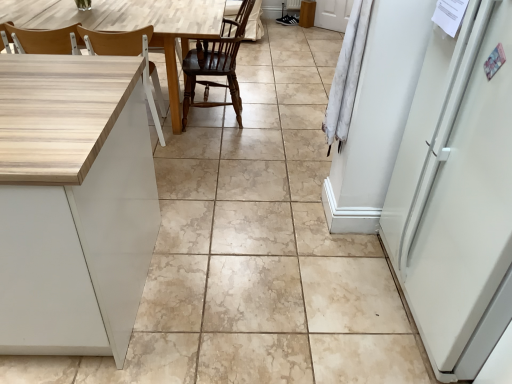
Question: Is wooden at left, the 1th chair viewed from the left, not close to light wood table at left?

Choices:
 (A) yes
 (B) no

Answer: (B)

Question: Is light wood table at left located within wooden at left, the 1th chair viewed from the left?

Choices:
 (A) no
 (B) yes

Answer: (A)

Question: Is wooden at left, which appears as the second chair when viewed from the right, taller than light wood table at left?

Choices:
 (A) yes
 (B) no

Answer: (A)

Question: Is wooden at left, which appears as the second chair when viewed from the right, positioned with its back to light wood table at left?

Choices:
 (A) no
 (B) yes

Answer: (B)

Question: From the image's perspective, would you say wooden at left, the 1th chair viewed from the left, is positioned over light wood table at left?

Choices:
 (A) yes
 (B) no

Answer: (B)

Question: Is wooden at left, the 1th chair viewed from the left, wider than light wood table at left?

Choices:
 (A) yes
 (B) no

Answer: (B)

Question: Considering the relative positions of dark wood chair at center, which is the first chair from right to left, and wooden at left, the 1th chair viewed from the left, in the image provided, is dark wood chair at center, which is the first chair from right to left, to the left of wooden at left, the 1th chair viewed from the left, from the viewer's perspective?

Choices:
 (A) no
 (B) yes

Answer: (A)

Question: From the image's perspective, is dark wood chair at center, which is the first chair from right to left, over wooden at left, which appears as the second chair when viewed from the right?

Choices:
 (A) yes
 (B) no

Answer: (A)

Question: Are dark wood chair at center, which is the first chair from right to left, and wooden at left, the 1th chair viewed from the left, beside each other?

Choices:
 (A) no
 (B) yes

Answer: (A)

Question: Is dark wood chair at center, which is the first chair from right to left, positioned behind wooden at left, the 1th chair viewed from the left?

Choices:
 (A) yes
 (B) no

Answer: (A)

Question: Is dark wood chair at center, the second chair from the left, completely or partially outside of wooden at left, the 1th chair viewed from the left?

Choices:
 (A) no
 (B) yes

Answer: (B)

Question: Could you tell me if dark wood chair at center, the second chair from the left, is turned towards wooden at left, which appears as the second chair when viewed from the right?

Choices:
 (A) yes
 (B) no

Answer: (A)

Question: Are wooden at left, the 1th chair viewed from the left, and dark wood chair at center, which is the first chair from right to left, far apart?

Choices:
 (A) yes
 (B) no

Answer: (B)